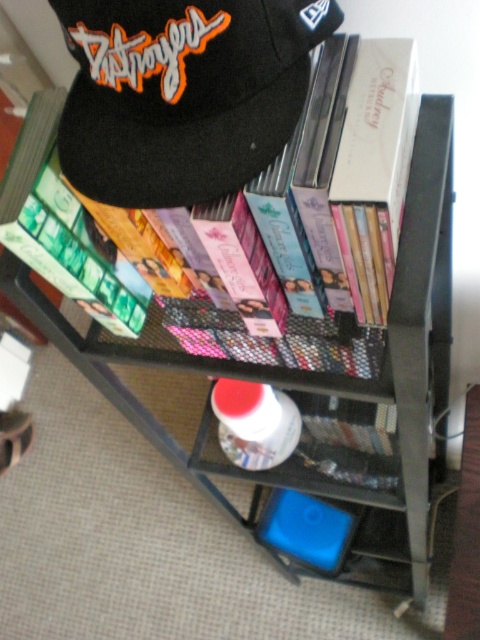
Can you confirm if black felt cap at upper left is bigger than white glossy bottle at center?

No, black felt cap at upper left is not bigger than white glossy bottle at center.

Between black felt cap at upper left and white glossy bottle at center, which one appears on the left side from the viewer's perspective?

black felt cap at upper left

Measure the distance between black felt cap at upper left and camera.

black felt cap at upper left and camera are 43.01 centimeters apart.

Identify the location of black felt cap at upper left. This screenshot has height=640, width=480. (182, 93).